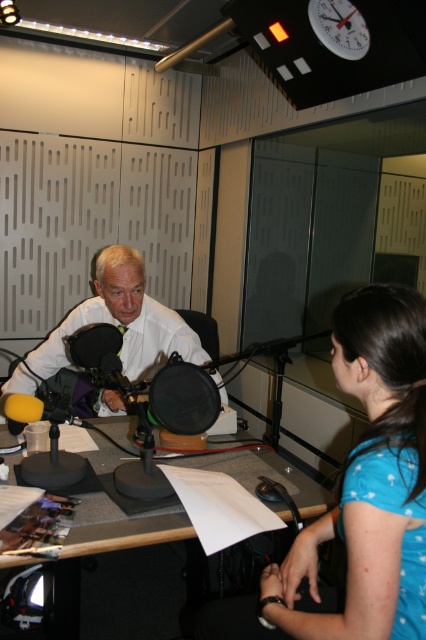
Is point (360, 547) behind point (140, 348)?

No, it is in front of (140, 348).

Can you confirm if blue cotton shirt at lower right is wider than white glossy shirt at center?

Incorrect, blue cotton shirt at lower right's width does not surpass white glossy shirt at center's.

Locate an element on the screen. This screenshot has width=426, height=640. blue cotton shirt at lower right is located at coordinates (371, 477).

Where is `blue cotton shirt at lower right`? The image size is (426, 640). blue cotton shirt at lower right is located at coordinates (371, 477).

Does blue cotton shirt at lower right have a greater width compared to gray matte desk at center?

In fact, blue cotton shirt at lower right might be narrower than gray matte desk at center.

Is point (420, 413) positioned after point (141, 541)?

No, (420, 413) is closer to viewer.

The width and height of the screenshot is (426, 640). Identify the location of blue cotton shirt at lower right. (371, 477).

Does white glossy shirt at center have a greater height compared to white plastic clock at upper center?

Indeed, white glossy shirt at center has a greater height compared to white plastic clock at upper center.

Who is more distant from viewer, (92, 300) or (357, 28)?

Point (92, 300)

You are a GUI agent. You are given a task and a screenshot of the screen. Output one action in this format:
    pyautogui.click(x=<x>, y=<y>)
    Task: Click on the white glossy shirt at center
    Image resolution: width=426 pixels, height=640 pixels.
    Given the screenshot: What is the action you would take?
    pyautogui.click(x=123, y=321)